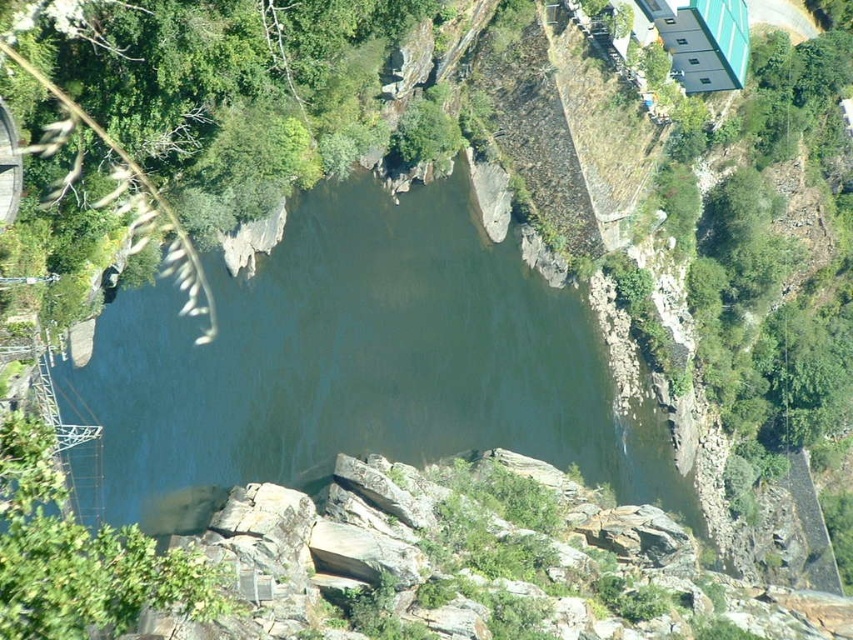
You are standing at the point labeled as point (347, 70) and want to walk to the point labeled as point (199, 362). Which direction should you move to get closer to your destination?

You should move towards the direction of point (199, 362) since it is closer to you than point (347, 70).

Consider the image. You are a drone operator trying to capture a photo of the greenish gray water at center. You are currently positioned at point (352,365). Is this the correct location to take the photo?

Yes, the greenish gray water at center is represented by point (352,365), so the drone is correctly positioned there to capture the photo.